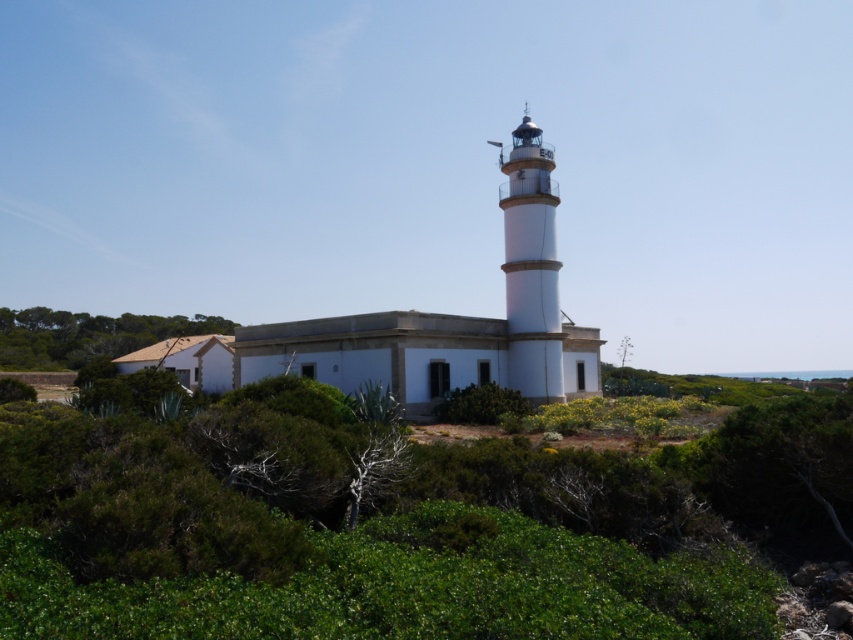
You are standing at the entrance of the rectangular building and want to reach the lighthouse. According to the image, where should you walk to avoid the green leafy shrubs at center?

The green leafy shrubs at center are located at point [386,525], so you should walk around them either to the left or right to reach the lighthouse.

You are a visitor standing at the base of the white smooth tower at center and looking towards the green leafy shrubs at lower left. Which object appears wider from your perspective?

→ The green leafy shrubs at lower left appear wider than the white smooth tower at center because the white smooth tower at center has a lesser width compared to green leafy shrubs at lower left.